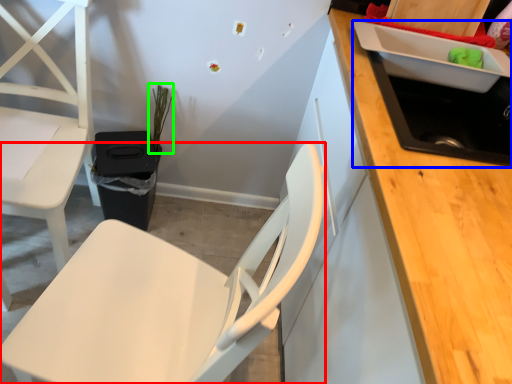
Question: Based on their relative distances, which object is nearer to chair (highlighted by a red box)? Choose from sink (highlighted by a blue box) and plant (highlighted by a green box).

Choices:
 (A) sink
 (B) plant

Answer: (A)